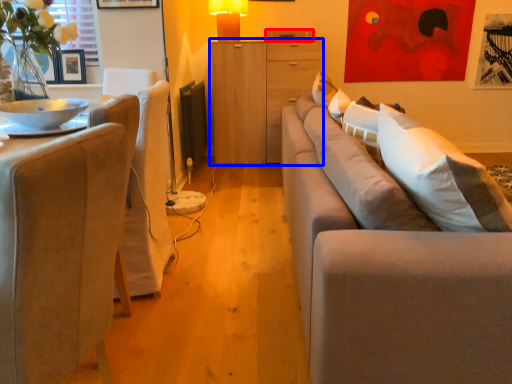
Question: Which object appears farthest to the camera in this image, drawer (highlighted by a red box) or cabinetry (highlighted by a blue box)?

Choices:
 (A) drawer
 (B) cabinetry

Answer: (A)